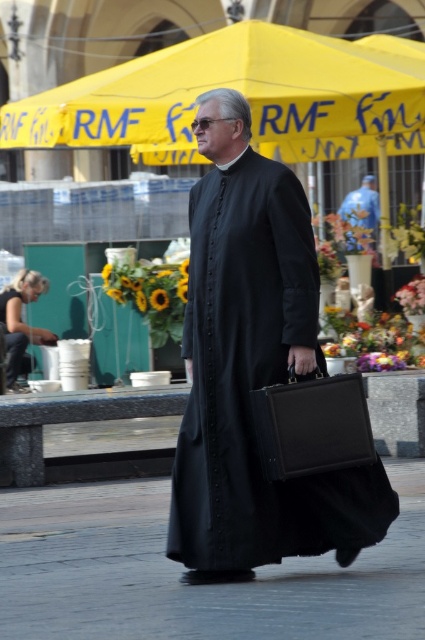
Can you confirm if yellow fabric canopy at upper center is thinner than blue fabric at center?

Yes.

Locate an element on the screen. The height and width of the screenshot is (640, 425). yellow fabric canopy at upper center is located at coordinates (238, 90).

Where is `yellow fabric canopy at upper center`? The height and width of the screenshot is (640, 425). yellow fabric canopy at upper center is located at coordinates (238, 90).

Based on the photo, is black matte robe at center bigger than blue fabric at center?

Incorrect, black matte robe at center is not larger than blue fabric at center.

What do you see at coordinates (254, 369) in the screenshot? This screenshot has width=425, height=640. I see `black matte robe at center` at bounding box center [254, 369].

Where is `black matte robe at center`? The width and height of the screenshot is (425, 640). black matte robe at center is located at coordinates (254, 369).

Which is in front, point (377, 484) or point (401, 616)?

Point (401, 616) is more forward.

Is black matte robe at center further to camera compared to smooth concrete pavement at center?

Yes, it is behind smooth concrete pavement at center.

Which is behind, point (173, 490) or point (235, 632)?

The point (173, 490) is more distant.

Locate an element on the screen. Image resolution: width=425 pixels, height=640 pixels. black matte robe at center is located at coordinates (254, 369).